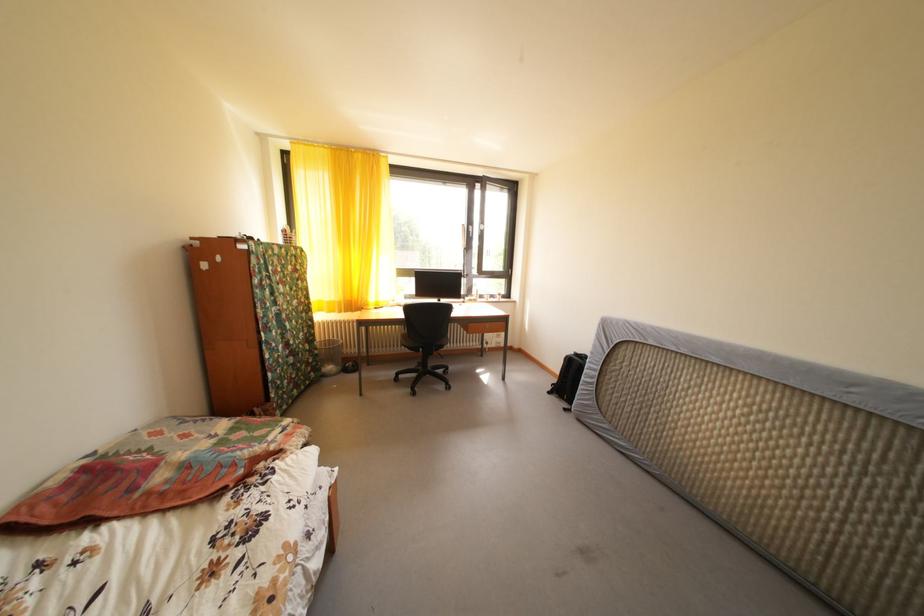
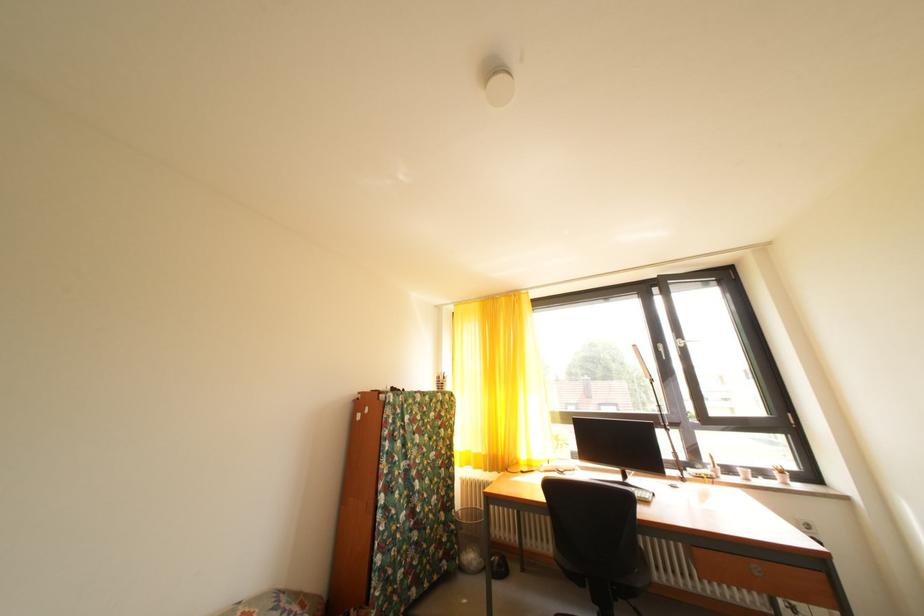
Where in the second image is the point corresponding to point (325, 358) from the first image?

(462, 533)